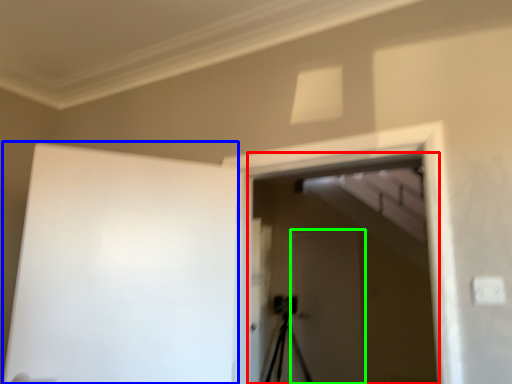
Question: Based on their relative distances, which object is nearer to screen door (highlighted by a red box)? Choose from barn door (highlighted by a blue box) and screen door (highlighted by a green box).

Choices:
 (A) barn door
 (B) screen door

Answer: (B)